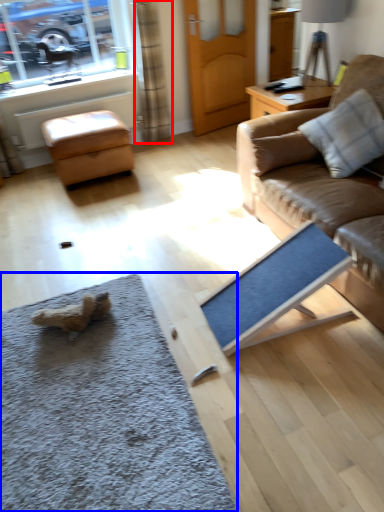
Question: Among these objects, which one is farthest to the camera, curtain (highlighted by a red box) or doormat (highlighted by a blue box)?

Choices:
 (A) curtain
 (B) doormat

Answer: (A)